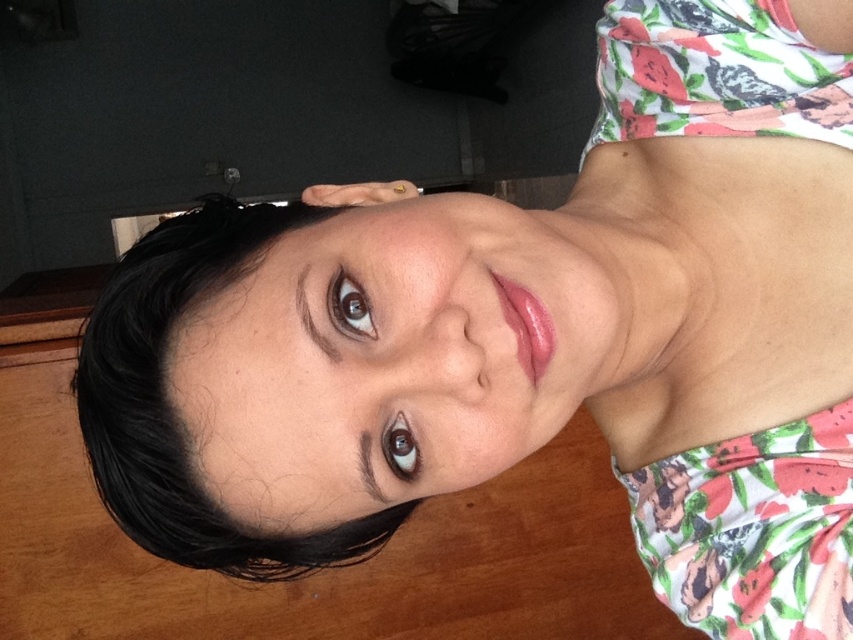
Who is positioned more to the left, black smooth hair at upper left or floral fabric bikini top at upper right?

Positioned to the left is black smooth hair at upper left.

Who is more forward, [80,365] or [776,28]?

Point [80,365] is more forward.

Find the location of a particular element. Image resolution: width=853 pixels, height=640 pixels. black smooth hair at upper left is located at coordinates (175, 408).

Does floral fabric dress at center appear under floral fabric bikini top at upper right?

Yes.

Is floral fabric dress at center positioned at the back of floral fabric bikini top at upper right?

No, it is not.

Between point (714, 538) and point (630, 72), which one is positioned behind?

Point (630, 72)

Image resolution: width=853 pixels, height=640 pixels. In order to click on floral fabric dress at center in this screenshot , I will do `click(753, 531)`.

Who is higher up, black smooth hair at upper left or floral fabric dress at center?

floral fabric dress at center is higher up.

Between point (396, 513) and point (728, 445), which one is positioned behind?

The point (728, 445) is behind.

Does point (132, 424) come in front of point (698, 470)?

Yes, it is in front of point (698, 470).

I want to click on black smooth hair at upper left, so click(x=175, y=408).